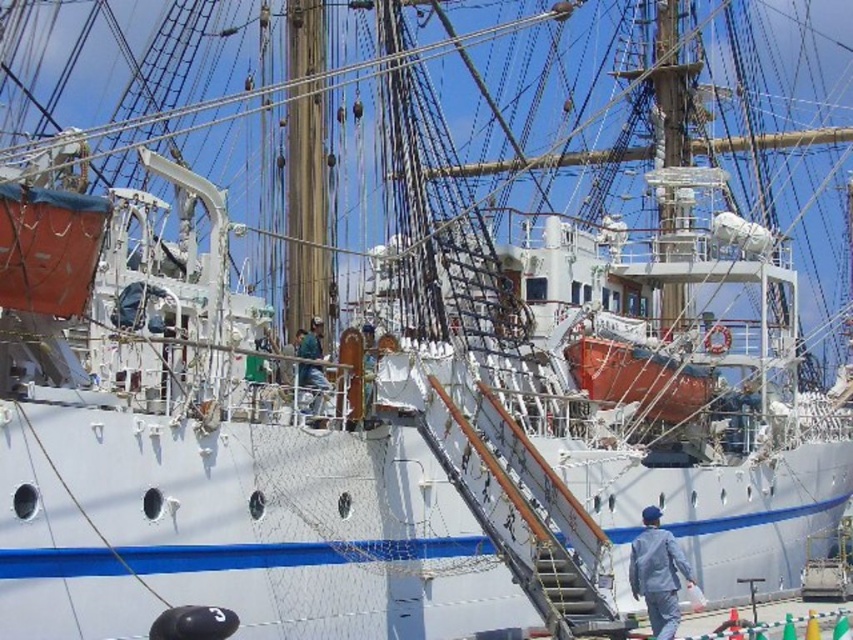
Can you confirm if light blue fabric jacket at lower right is positioned to the left of green matte shirt at center?

No, light blue fabric jacket at lower right is not to the left of green matte shirt at center.

Consider the image. Does light blue fabric jacket at lower right have a lesser width compared to green matte shirt at center?

No.

Where is `light blue fabric jacket at lower right`? This screenshot has height=640, width=853. light blue fabric jacket at lower right is located at coordinates (657, 573).

Find the location of `light blue fabric jacket at lower right`. light blue fabric jacket at lower right is located at coordinates (657, 573).